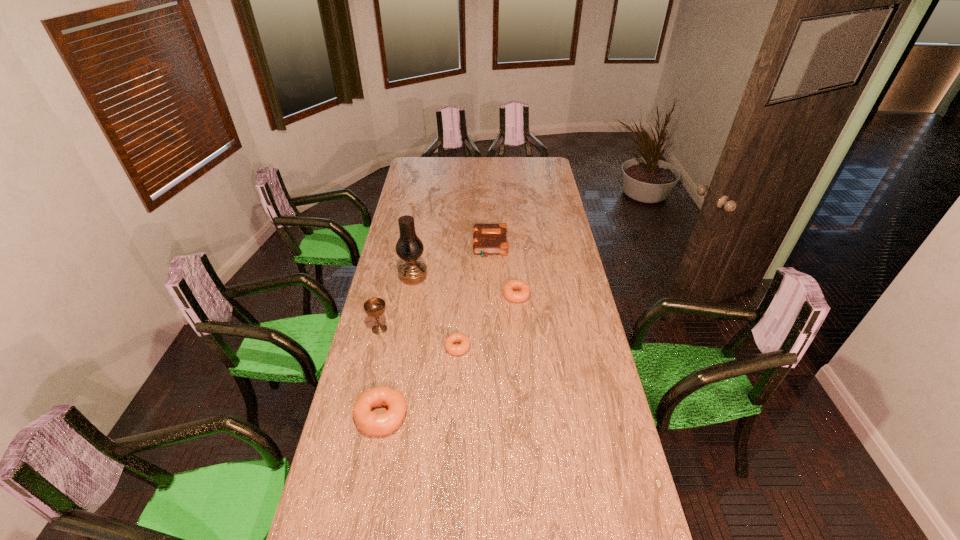
All doughnuts are currently evenly spaced. To continue this pattern, where would you add another doughnut on the right? Please point out a vacant spot. Please provide its 2D coordinates. Your answer should be formatted as a tuple, i.e. [(x, y)], where the tuple contains the x and y coordinates of a point satisfying the conditions above.

[(563, 253)]